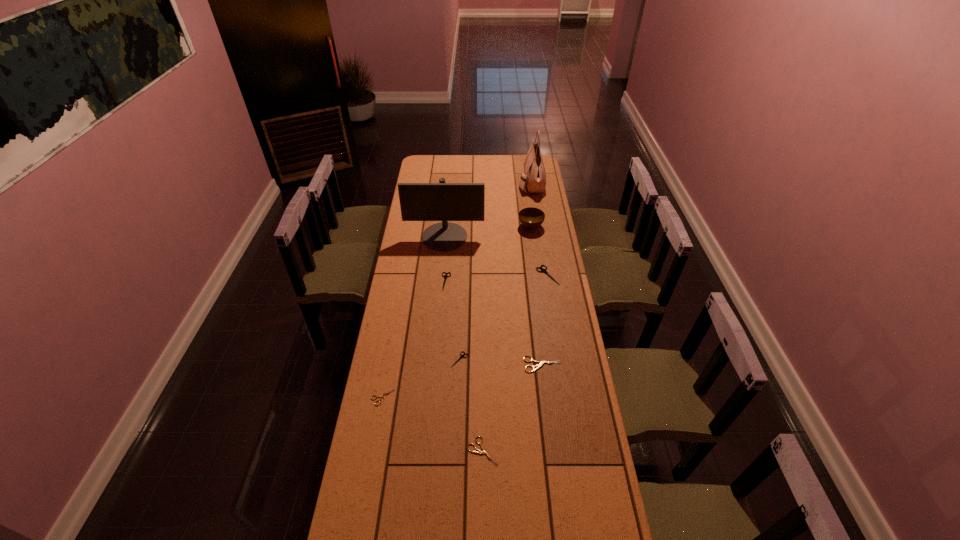
The image size is (960, 540). Identify the location of black shears that stands as the closest to the third shears from left to right. (445, 276).

Where is `beige shears object that ranks as the closest to the sixth shortest object`? beige shears object that ranks as the closest to the sixth shortest object is located at coordinates (541, 363).

Locate which beige shears ranks second in proximity to the fourth shears from left to right. Please provide its 2D coordinates. Your answer should be formatted as a tuple, i.e. [(x, y)], where the tuple contains the x and y coordinates of a point satisfying the conditions above.

[(383, 395)]

This screenshot has width=960, height=540. Identify the location of free point that satisfies the following two spatial constraints: 1. on the screen of the computer monitor; 2. on the left side of the biggest beige shears. (433, 364).

The height and width of the screenshot is (540, 960). Find the location of `blank space that satisfies the following two spatial constraints: 1. on the back side of the farthest beige shears; 2. on the left side of the second nearest beige shears`. blank space that satisfies the following two spatial constraints: 1. on the back side of the farthest beige shears; 2. on the left side of the second nearest beige shears is located at coordinates (389, 364).

I want to click on vacant space that satisfies the following two spatial constraints: 1. on the side of the handbag with the attached pouch; 2. on the front side of the shortest object, so click(x=564, y=397).

Locate an element on the screen. vacant space that satisfies the following two spatial constraints: 1. on the side of the farthest object with the attached pouch; 2. on the front side of the biggest beige shears is located at coordinates (559, 364).